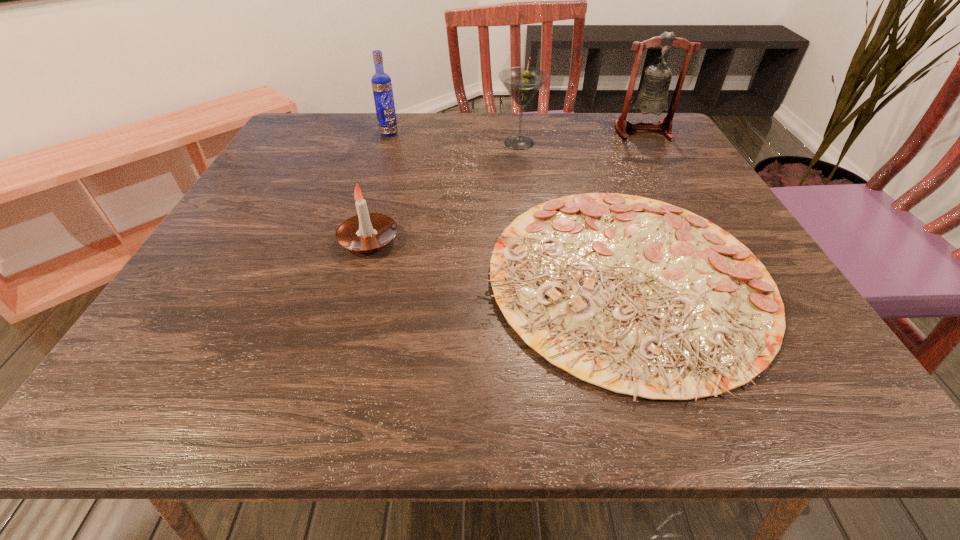
Locate an element on the screen. bell is located at coordinates (651, 97).

Identify the location of vodka. (381, 82).

Locate an element on the screen. This screenshot has width=960, height=540. martini is located at coordinates (522, 83).

The width and height of the screenshot is (960, 540). Identify the location of the fourth tallest object. (366, 232).

Locate an element on the screen. Image resolution: width=960 pixels, height=540 pixels. the shortest object is located at coordinates (640, 297).

Locate an element on the screen. This screenshot has height=540, width=960. vacant space located on the back of the bell is located at coordinates (633, 114).

Where is `blank space located on the right of the vodka`? The height and width of the screenshot is (540, 960). blank space located on the right of the vodka is located at coordinates (546, 133).

This screenshot has width=960, height=540. I want to click on free space located 0.260m on the left of the martini, so click(x=392, y=143).

Locate an element on the screen. The height and width of the screenshot is (540, 960). vacant space located on the right of the candle is located at coordinates (570, 240).

The image size is (960, 540). I want to click on blank space located 0.070m on the back of the pizza, so click(x=591, y=181).